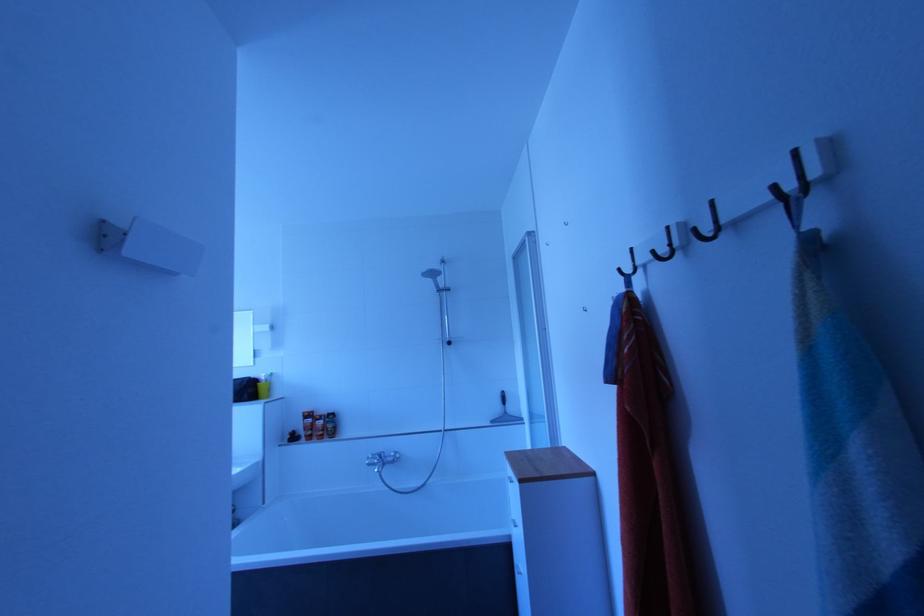
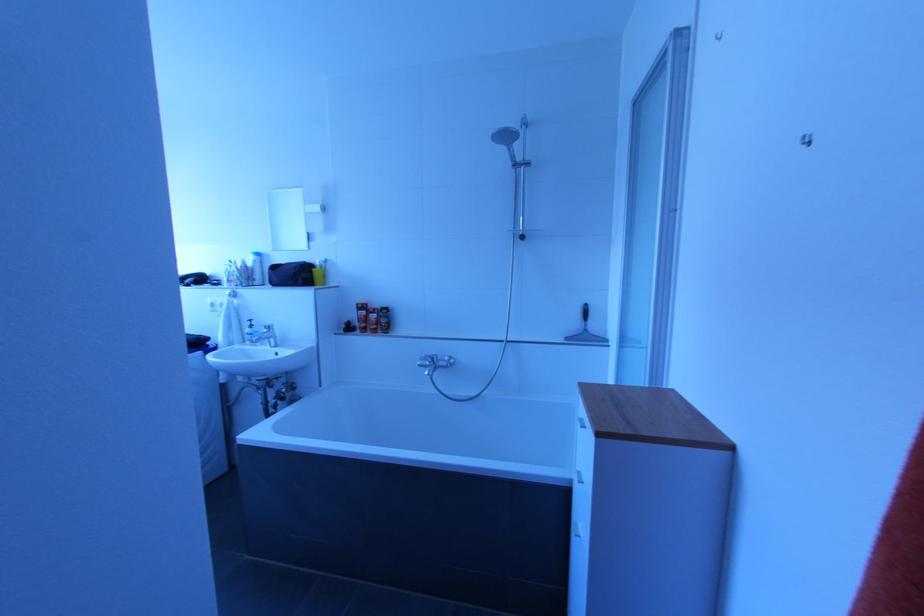
Question: How did the camera likely rotate?

Choices:
 (A) Left
 (B) Right
 (C) Up
 (D) Down

Answer: (D)